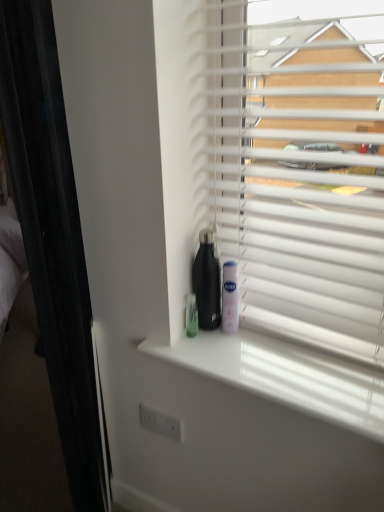
Question: Should I look upward or downward to see white glossy window sill at center?

Choices:
 (A) down
 (B) up

Answer: (A)

Question: From the image's perspective, does white glossy window sill at center appear lower than white plastic blinds at upper right?

Choices:
 (A) yes
 (B) no

Answer: (A)

Question: From a real-world perspective, is white glossy window sill at center positioned over white plastic blinds at upper right based on gravity?

Choices:
 (A) no
 (B) yes

Answer: (A)

Question: Is white glossy window sill at center to the left of white plastic blinds at upper right from the viewer's perspective?

Choices:
 (A) no
 (B) yes

Answer: (B)

Question: Is white glossy window sill at center directly adjacent to white plastic blinds at upper right?

Choices:
 (A) yes
 (B) no

Answer: (B)

Question: Does white glossy window sill at center have a smaller size compared to white plastic blinds at upper right?

Choices:
 (A) yes
 (B) no

Answer: (A)

Question: Is white glossy window sill at center positioned before white plastic blinds at upper right?

Choices:
 (A) yes
 (B) no

Answer: (B)

Question: Can you confirm if white plastic mouthwash at center is positioned to the left of white plastic blinds at upper right?

Choices:
 (A) yes
 (B) no

Answer: (A)

Question: Is white plastic mouthwash at center outside white plastic blinds at upper right?

Choices:
 (A) no
 (B) yes

Answer: (A)

Question: From a real-world perspective, is white plastic mouthwash at center positioned under white plastic blinds at upper right based on gravity?

Choices:
 (A) no
 (B) yes

Answer: (B)

Question: Could you tell me if white plastic mouthwash at center is turned towards white plastic blinds at upper right?

Choices:
 (A) yes
 (B) no

Answer: (A)

Question: From the image's perspective, is white plastic mouthwash at center located beneath white plastic blinds at upper right?

Choices:
 (A) yes
 (B) no

Answer: (A)

Question: Does white plastic mouthwash at center have a larger size compared to white plastic blinds at upper right?

Choices:
 (A) no
 (B) yes

Answer: (A)

Question: Are white plastic blinds at upper right and white plastic mouthwash at center located far from each other?

Choices:
 (A) yes
 (B) no

Answer: (B)